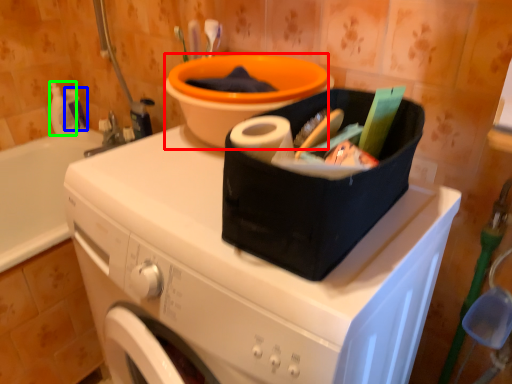
Question: Which object is positioned closest to basin (highlighted by a red box)? Select from cleaning product (highlighted by a blue box) and cleaning product (highlighted by a green box).

Choices:
 (A) cleaning product
 (B) cleaning product

Answer: (A)